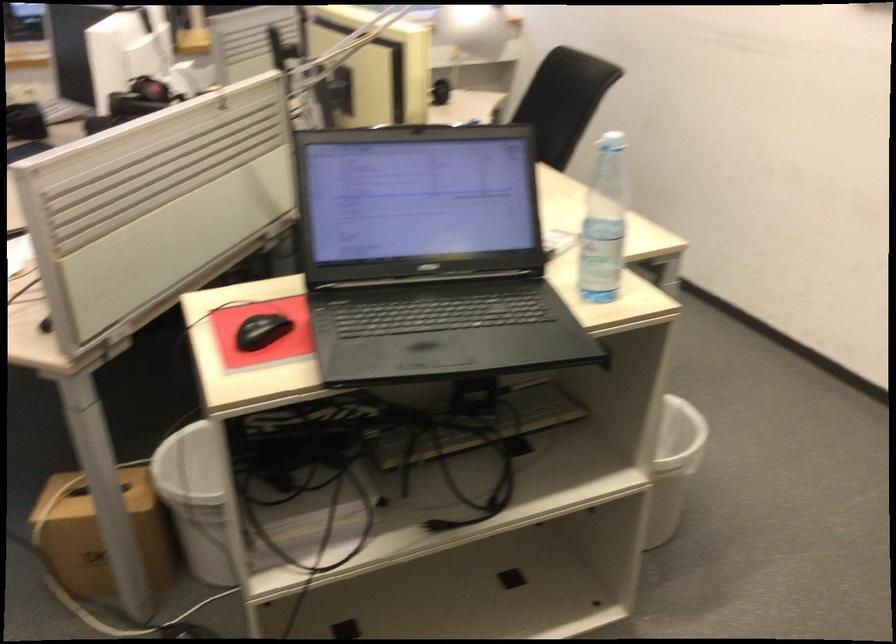
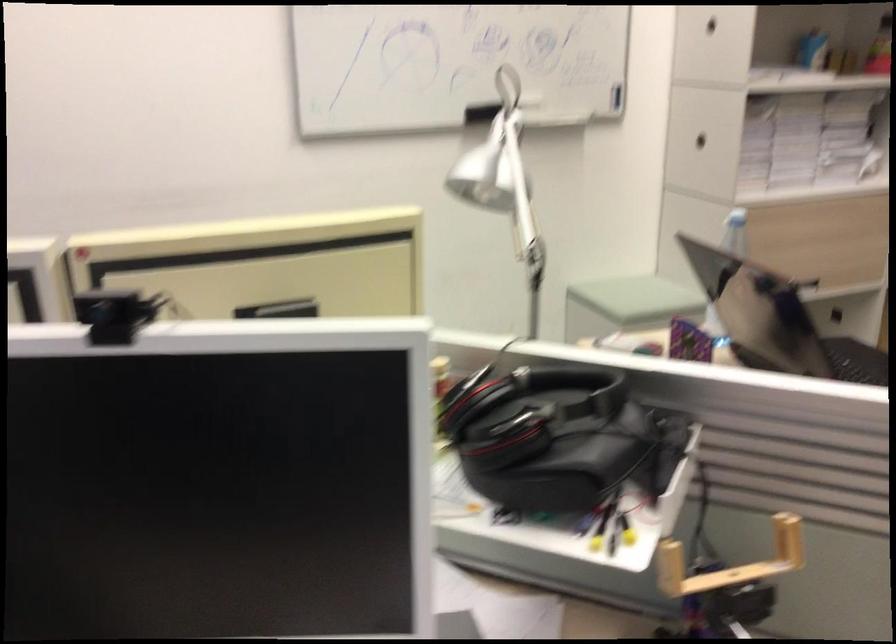
Find the pixel in the second image that matches point (156, 270) in the first image.

(730, 562)